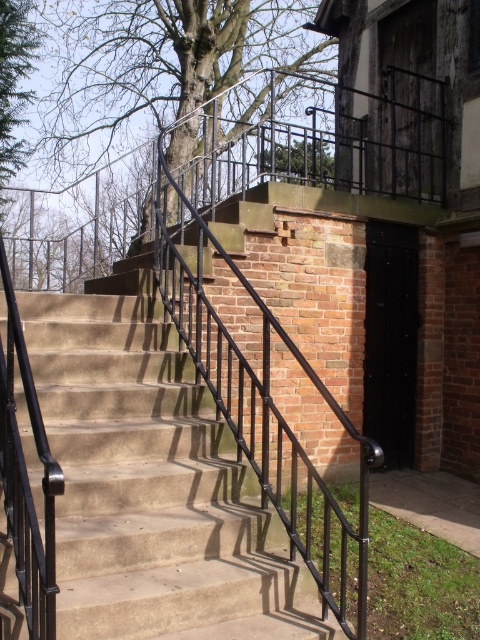
Does point (140, 512) lie behind point (14, 45)?

No.

Is concrete/steps at center wider than green leafy tree at upper left?

Yes.

Between point (117, 548) and point (16, 6), which one is positioned in front?

Point (117, 548) is more forward.

The height and width of the screenshot is (640, 480). What are the coordinates of `concrete/steps at center` in the screenshot? It's located at (154, 484).

Between point (126, 294) and point (158, 76), which one is positioned behind?

Point (158, 76)

Identify the location of concrete/steps at center. The width and height of the screenshot is (480, 640). (154, 484).

Is point (139, 632) closer to viewer compared to point (290, 48)?

Yes, point (139, 632) is closer to viewer.

This screenshot has height=640, width=480. Find the location of `concrete/steps at center`. concrete/steps at center is located at coordinates (154, 484).

Does bare wood tree at upper center appear under green leafy tree at upper left?

Actually, bare wood tree at upper center is above green leafy tree at upper left.

Can you confirm if bare wood tree at upper center is positioned to the right of green leafy tree at upper left?

Correct, you'll find bare wood tree at upper center to the right of green leafy tree at upper left.

Measure the distance between point (122, 116) and camera.

Point (122, 116) and camera are 12.81 meters apart from each other.

Where is `bare wood tree at upper center`? This screenshot has width=480, height=640. bare wood tree at upper center is located at coordinates (158, 67).